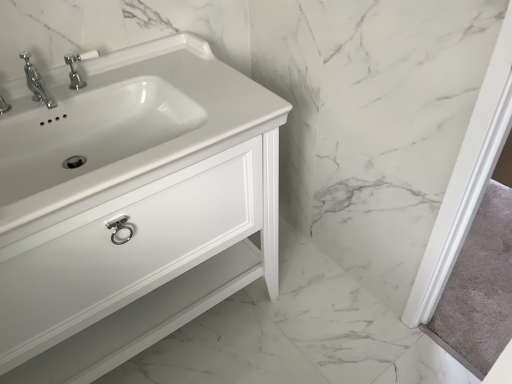
Measure the distance between point (157, 221) and camera.

Point (157, 221) and camera are 1.05 meters apart from each other.

In order to face white glossy cabinet at left, should I rotate leftwards or rightwards?

Rotate your view left by about 18.490°.

You are a GUI agent. You are given a task and a screenshot of the screen. Output one action in this format:
    pyautogui.click(x=<x>, y=<y>)
    Task: Click on the white glossy cabinet at left
    This screenshot has height=384, width=512.
    Given the screenshot: What is the action you would take?
    pyautogui.click(x=131, y=206)

The width and height of the screenshot is (512, 384). Describe the element at coordinates (131, 206) in the screenshot. I see `white glossy cabinet at left` at that location.

What do you see at coordinates (76, 70) in the screenshot? The width and height of the screenshot is (512, 384). I see `white ceramic tap at upper left` at bounding box center [76, 70].

At what (x,y) coordinates should I click in order to perform the action: click on white ceramic tap at upper left. Please return your answer as a coordinate pair (x, y). This screenshot has width=512, height=384. Looking at the image, I should click on (76, 70).

At what (x,y) coordinates should I click in order to perform the action: click on white glossy cabinet at left. Please return your answer as a coordinate pair (x, y). This screenshot has height=384, width=512. Looking at the image, I should click on (131, 206).

In the image, is white ceramic tap at upper left on the left side or the right side of white glossy cabinet at left?

Clearly, white ceramic tap at upper left is on the left of white glossy cabinet at left in the image.

Is white ceramic tap at upper left closer to the viewer compared to white glossy cabinet at left?

No, it is behind white glossy cabinet at left.

Is point (73, 85) positioned before point (175, 234)?

No.

From the image's perspective, between white ceramic tap at upper left and white glossy cabinet at left, which one is located above?

From the image's view, white ceramic tap at upper left is above.

From a real-world perspective, is white ceramic tap at upper left physically below white glossy cabinet at left?

Incorrect, from a real-world perspective, white ceramic tap at upper left is higher than white glossy cabinet at left.

Is white ceramic tap at upper left thinner than white glossy cabinet at left?

Indeed, white ceramic tap at upper left has a lesser width compared to white glossy cabinet at left.

Can you confirm if white ceramic tap at upper left is taller than white glossy cabinet at left?

In fact, white ceramic tap at upper left may be shorter than white glossy cabinet at left.

From the picture: Who is smaller, white ceramic tap at upper left or white glossy cabinet at left?

Smaller between the two is white ceramic tap at upper left.

Is white ceramic tap at upper left not inside white glossy cabinet at left?

That's incorrect, white ceramic tap at upper left is not completely outside white glossy cabinet at left.

Are white ceramic tap at upper left and white glossy cabinet at left located far from each other?

No, white ceramic tap at upper left is not far away from white glossy cabinet at left.

Is white ceramic tap at upper left positioned with its back to white glossy cabinet at left?

white ceramic tap at upper left does not have its back to white glossy cabinet at left.

Where is `tap located behind the white glossy cabinet at left`? The image size is (512, 384). tap located behind the white glossy cabinet at left is located at coordinates (76, 70).

Considering the positions of objects white glossy cabinet at left and white ceramic tap at upper left in the image provided, who is more to the left, white glossy cabinet at left or white ceramic tap at upper left?

Positioned to the left is white ceramic tap at upper left.

Does white glossy cabinet at left come behind white ceramic tap at upper left?

No, white glossy cabinet at left is closer to the viewer.

Does point (101, 204) come behind point (97, 56)?

No, it is not.

From the picture: From the image's perspective, which is below, white glossy cabinet at left or white ceramic tap at upper left?

white glossy cabinet at left.

From a real-world perspective, which is physically below, white glossy cabinet at left or white ceramic tap at upper left?

In real-world perspective, white glossy cabinet at left is lower.

Between white glossy cabinet at left and white ceramic tap at upper left, which one has larger width?

white glossy cabinet at left is wider.

Between white glossy cabinet at left and white ceramic tap at upper left, which one has less height?

Standing shorter between the two is white ceramic tap at upper left.

From the picture: Does white glossy cabinet at left have a larger size compared to white ceramic tap at upper left?

Yes.

Is white glossy cabinet at left completely or partially outside of white ceramic tap at upper left?

Yes.

Are white glossy cabinet at left and white ceramic tap at upper left making contact?

No, white glossy cabinet at left is not making contact with white ceramic tap at upper left.

Is white glossy cabinet at left facing away from white ceramic tap at upper left?

white glossy cabinet at left is not turned away from white ceramic tap at upper left.

Image resolution: width=512 pixels, height=384 pixels. I want to click on tap to the left of white glossy cabinet at left, so click(76, 70).

The width and height of the screenshot is (512, 384). In the image, there is a white glossy cabinet at left. Find the location of `tap above it (from the image's perspective)`. tap above it (from the image's perspective) is located at coordinates (76, 70).

In order to click on bathroom cabinet on the right of white ceramic tap at upper left in this screenshot , I will do `click(131, 206)`.